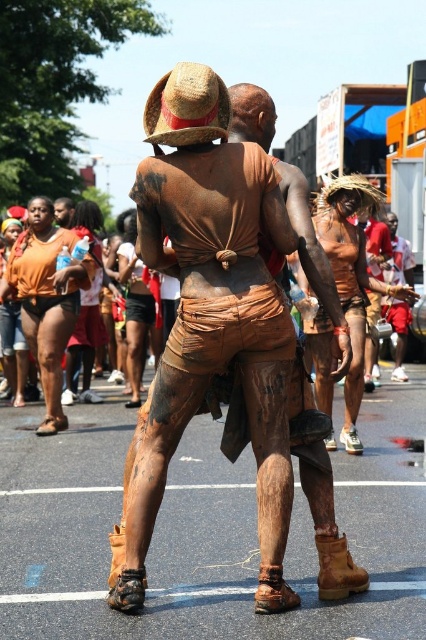
Question: Is matte brown mud at center positioned at the back of straw hat at upper center?

Choices:
 (A) no
 (B) yes

Answer: (A)

Question: Is matte brown mud at center positioned at the back of straw hat at upper center?

Choices:
 (A) yes
 (B) no

Answer: (B)

Question: Which point appears closest to the camera in this image?

Choices:
 (A) (241, 323)
 (B) (206, 116)

Answer: (A)

Question: Which object appears closest to the camera in this image?

Choices:
 (A) matte brown mud at center
 (B) straw hat at upper center

Answer: (A)

Question: Which point appears closest to the camera in this image?

Choices:
 (A) (176, 145)
 (B) (258, 362)

Answer: (B)

Question: Does matte brown mud at center appear on the left side of straw hat at upper center?

Choices:
 (A) yes
 (B) no

Answer: (B)